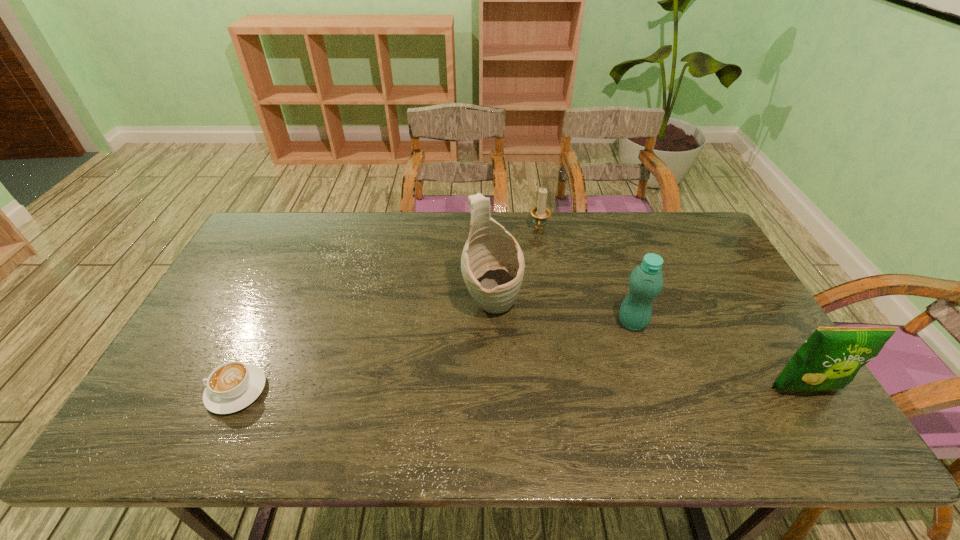
Find the location of a particular element. The height and width of the screenshot is (540, 960). free spot on the desktop that is between the leftmost object and the crisp (potato chip) and is positioned on the handle side of the third object from right to left is located at coordinates (511, 390).

Locate an element on the screen. The width and height of the screenshot is (960, 540). vacant spot on the desktop that is between the leftmost object and the rightmost object and is positioned at the spout of the fourth object from right to left is located at coordinates (553, 390).

Image resolution: width=960 pixels, height=540 pixels. Identify the location of vacant space on the desktop that is between the leftmost object and the rightmost object and is positioned at the front cap of the water bottle. 551,390.